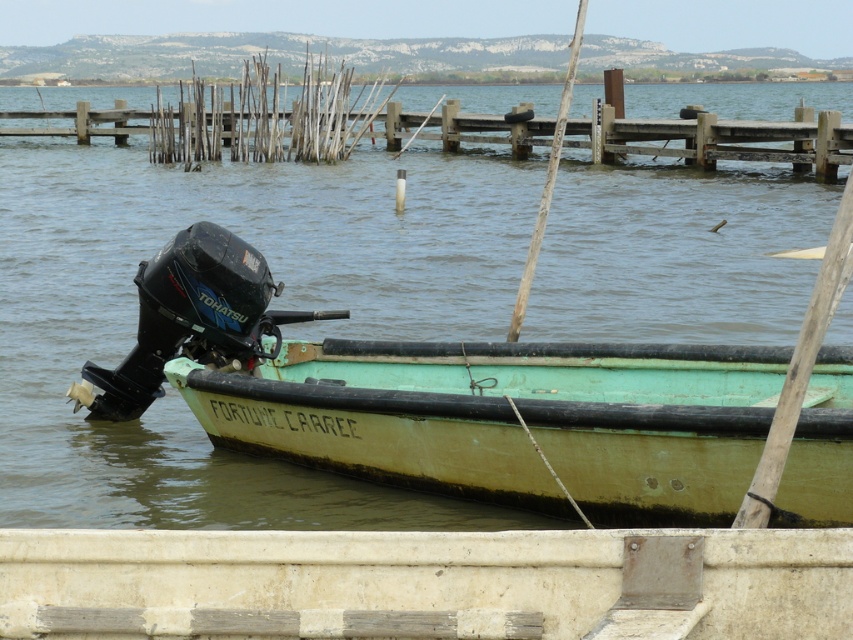
You are planning to dock the green matte boat at center onto the wooden dock at upper center. Based on their sizes, will the boat fit entirely on the dock?

The green matte boat at center is narrower than the wooden dock at upper center, so it should fit entirely on the dock.

You are planning to dock your green matte boat at center at the wooden dock at upper center. Based on the size comparison between them, will the boat fit entirely on the dock?

The green matte boat at center is smaller than the wooden dock at upper center, so it will fit entirely on the dock.